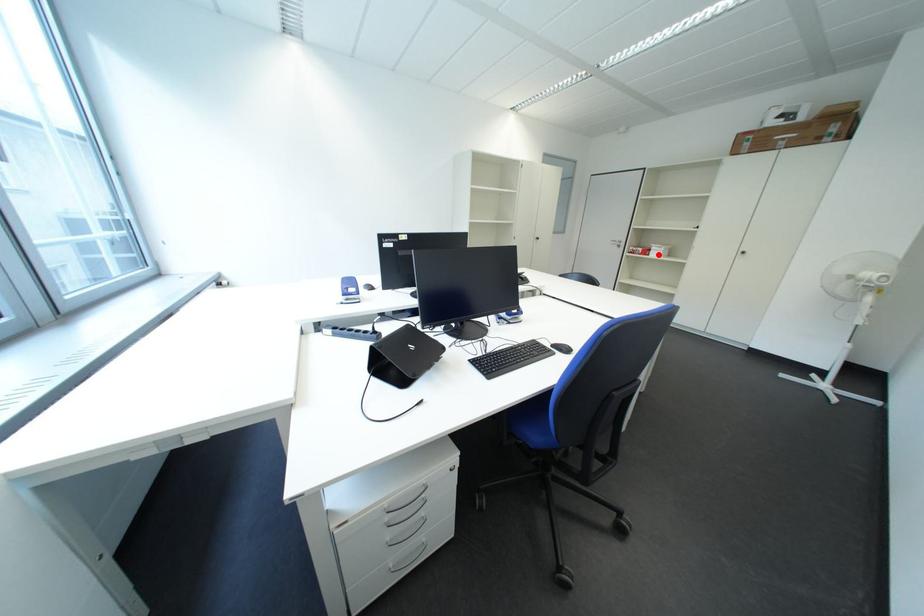
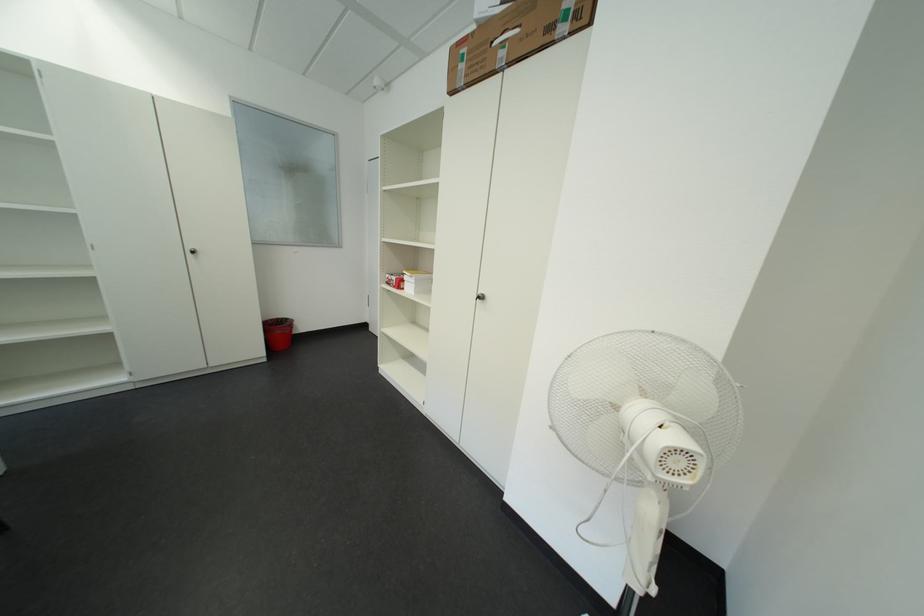
In the second image, find the point that corresponds to the highlighted location in the first image.

(411, 286)